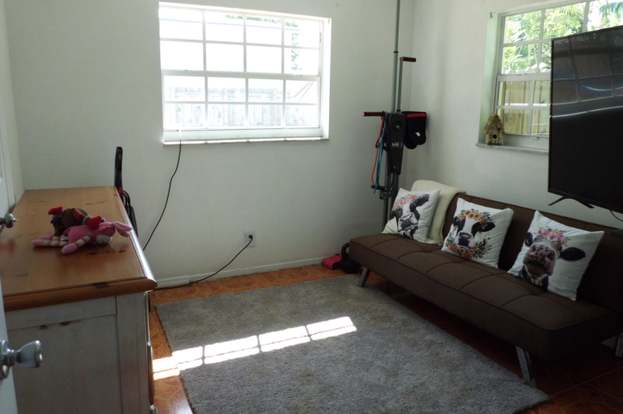
At what (x,y) coordinates should I click in order to perform the action: click on area rug. Please return your answer as a coordinate pair (x, y). The height and width of the screenshot is (414, 623). Looking at the image, I should click on (334, 367).